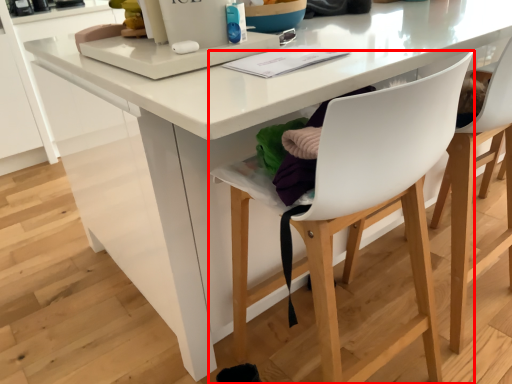
Question: From the image, what is the correct spatial relationship of chair (annotated by the red box) in relation to chair?

Choices:
 (A) left
 (B) right

Answer: (A)